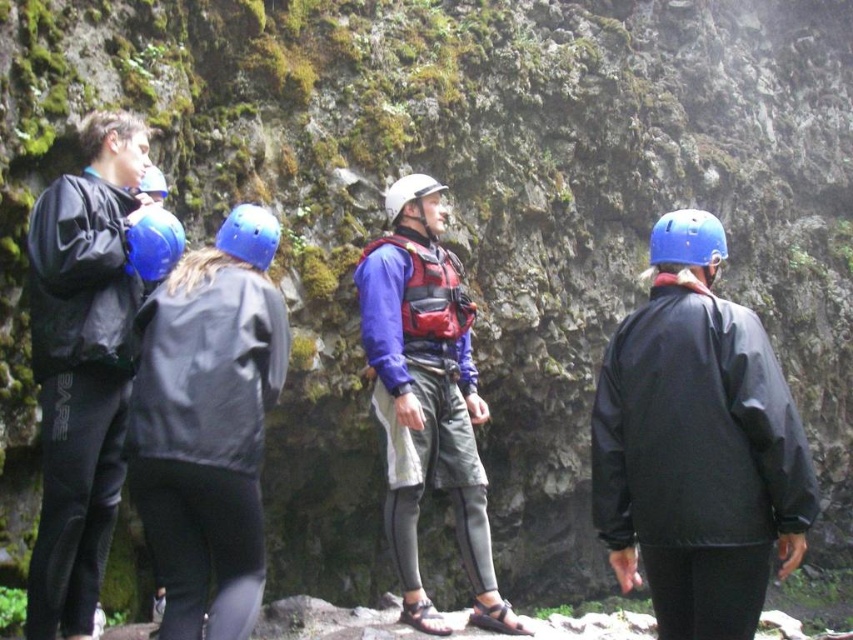
Does matte black wetsuit at left have a greater width compared to matte blue helmet at center?

No, matte black wetsuit at left is not wider than matte blue helmet at center.

Locate an element on the screen. Image resolution: width=853 pixels, height=640 pixels. matte black wetsuit at left is located at coordinates (82, 365).